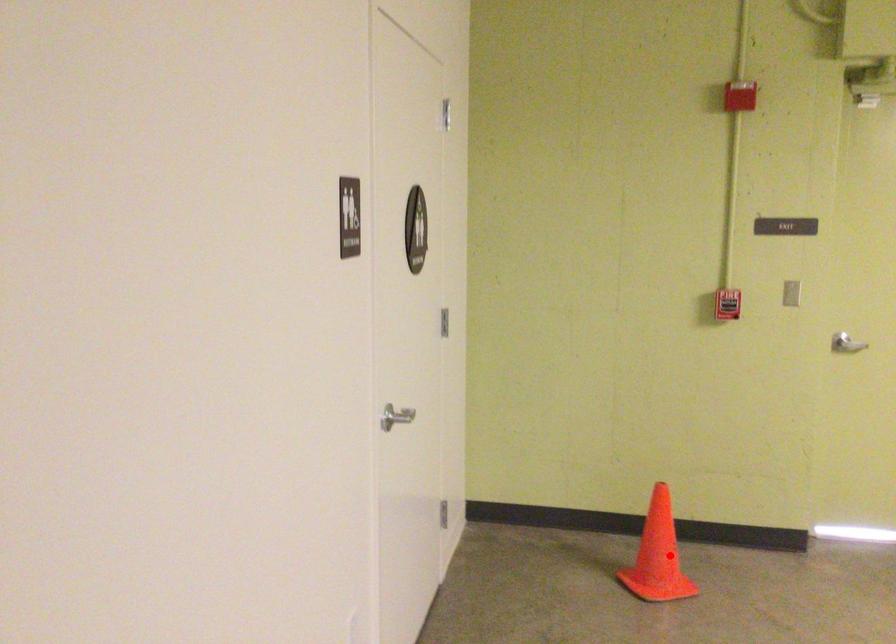
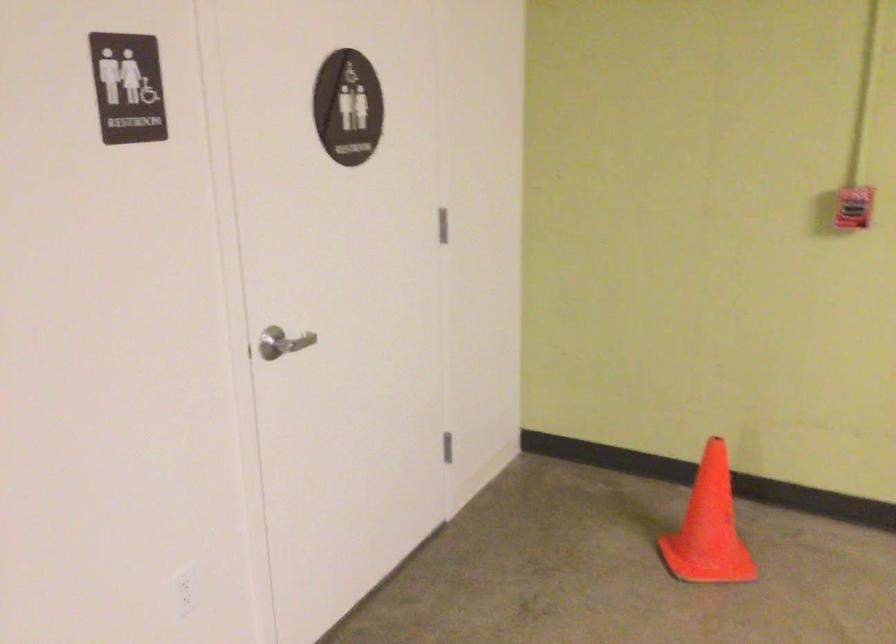
The point at the highlighted location is marked in the first image. Where is the corresponding point in the second image?

(709, 527)